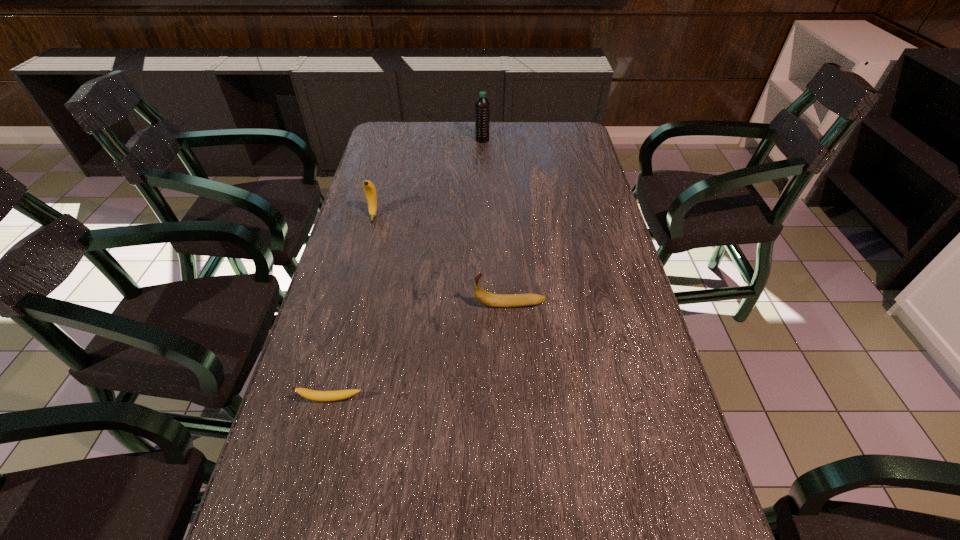
Find the location of a particular element. water bottle is located at coordinates (482, 105).

The height and width of the screenshot is (540, 960). Find the location of `the tallest object`. the tallest object is located at coordinates [x=482, y=105].

Where is `the farthest banana`? the farthest banana is located at coordinates (370, 191).

The height and width of the screenshot is (540, 960). I want to click on the second nearest object, so click(x=486, y=298).

This screenshot has width=960, height=540. Find the location of `the second farthest banana`. the second farthest banana is located at coordinates coord(486,298).

Where is `the nearest banana`? This screenshot has height=540, width=960. the nearest banana is located at coordinates (322, 396).

Find the location of `the nearest object`. the nearest object is located at coordinates (322, 396).

Find the location of a particular element. This screenshot has height=540, width=960. vacant space located 0.340m on the front of the water bottle is located at coordinates (483, 198).

Find the location of a particular element. This screenshot has width=960, height=540. free region located 0.140m from the stem of the farthest banana is located at coordinates (363, 255).

Where is `vacant space located at the stem of the third farthest object`? The width and height of the screenshot is (960, 540). vacant space located at the stem of the third farthest object is located at coordinates (418, 305).